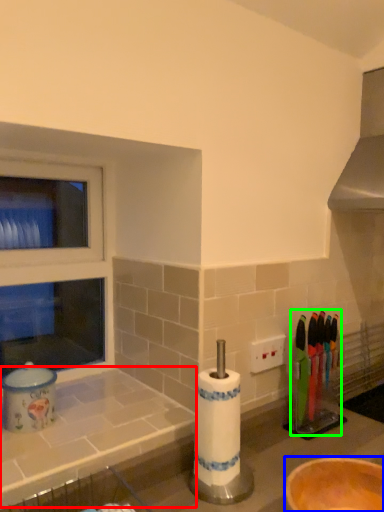
Question: Based on their relative distances, which object is nearer to counter top (highlighted by a red box)? Choose from bowl (highlighted by a blue box) and tableware (highlighted by a green box).

Choices:
 (A) bowl
 (B) tableware

Answer: (A)